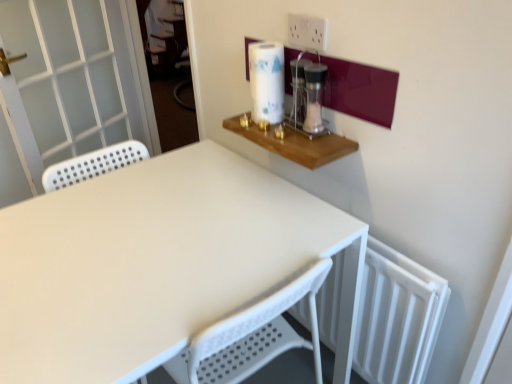
Where is `free location in front of clear glass jar at upper right`? The image size is (512, 384). free location in front of clear glass jar at upper right is located at coordinates tap(318, 147).